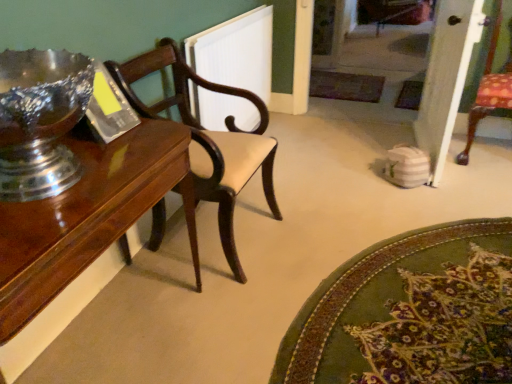
Where is `vacant area that is situated to the right of white textured radiator at upper center`? This screenshot has height=384, width=512. vacant area that is situated to the right of white textured radiator at upper center is located at coordinates (316, 150).